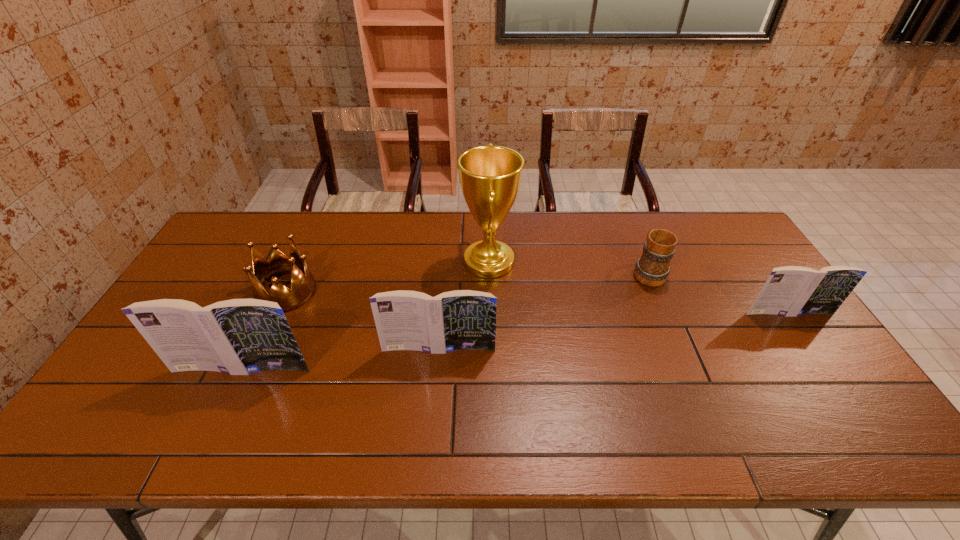
Image resolution: width=960 pixels, height=540 pixels. Find the location of `the nearest book`. the nearest book is located at coordinates (239, 336).

Find the location of `the nearest object`. the nearest object is located at coordinates (239, 336).

At what (x,y) coordinates should I click in order to perform the action: click on the second farthest book. Please return your answer as a coordinate pair (x, y). The height and width of the screenshot is (540, 960). Looking at the image, I should click on click(x=461, y=319).

The image size is (960, 540). In order to click on the second book from right to left in this screenshot , I will do point(461,319).

Image resolution: width=960 pixels, height=540 pixels. Find the location of `the rightmost book`. the rightmost book is located at coordinates (789, 291).

Identify the location of the shortest book. The image size is (960, 540). tap(789, 291).

The height and width of the screenshot is (540, 960). I want to click on award, so click(x=490, y=176).

Locate an element on the screen. the fifth object from left to right is located at coordinates (652, 269).

Image resolution: width=960 pixels, height=540 pixels. Find the location of `crown`. crown is located at coordinates (303, 286).

Identify the location of vacant area located 0.050m on the front cover of the nearest book. point(230,393).